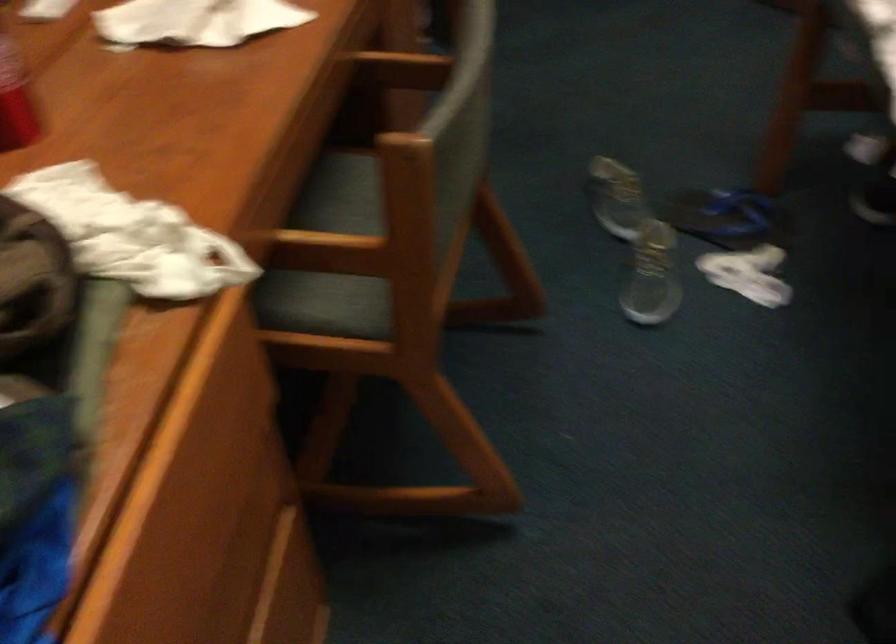
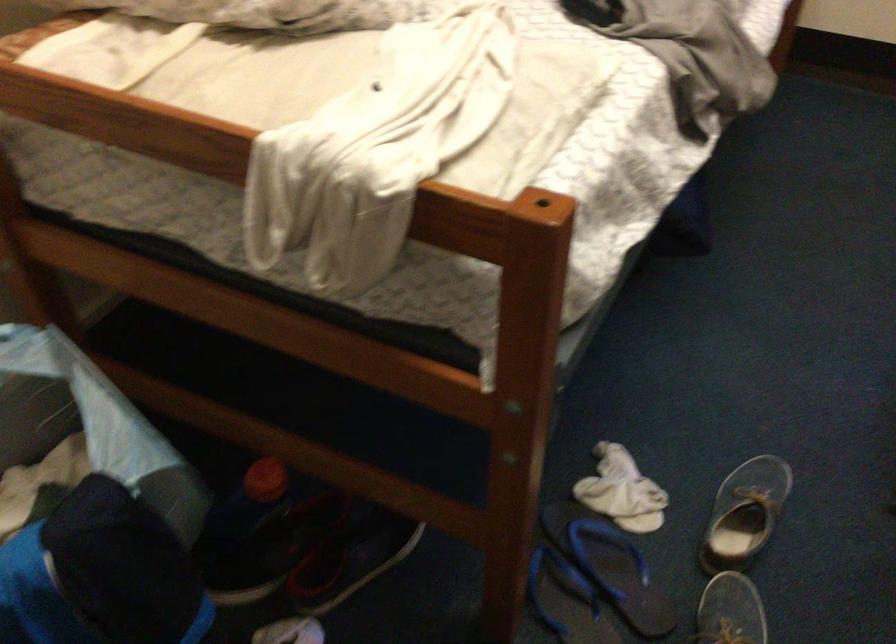
Locate, in the second image, the point that corresponds to (x=718, y=232) in the first image.

(609, 565)